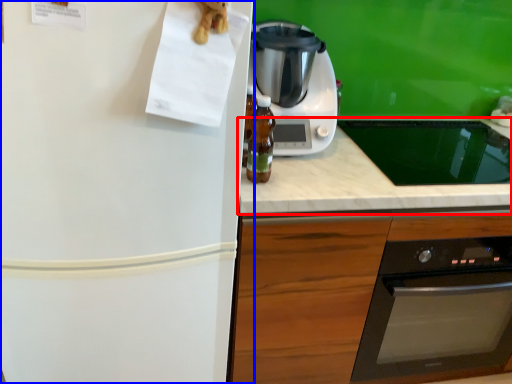
Question: Among these objects, which one is farthest to the camera, countertop (highlighted by a red box) or refrigerator (highlighted by a blue box)?

Choices:
 (A) countertop
 (B) refrigerator

Answer: (A)